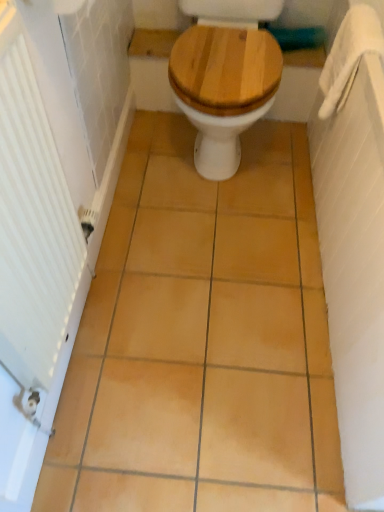
Where is `white fabric towel bar at upper right`? This screenshot has width=384, height=512. white fabric towel bar at upper right is located at coordinates (349, 55).

The image size is (384, 512). What do you see at coordinates (33, 229) in the screenshot? I see `white textured radiator at left` at bounding box center [33, 229].

What do you see at coordinates (354, 240) in the screenshot?
I see `white textured towel at right` at bounding box center [354, 240].

Measure the distance between point [177,60] and camera.

A distance of 1.39 meters exists between point [177,60] and camera.

Describe the element at coordinates (201, 340) in the screenshot. I see `matte yellow tile at center` at that location.

I want to click on white fabric towel bar at upper right, so click(x=349, y=55).

Is white fabric towel bar at upper right turned away from white textured towel at right?

That's right, white fabric towel bar at upper right is facing away from white textured towel at right.

Based on their positions, is white fabric towel bar at upper right located to the left or right of white textured towel at right?

From the image, it's evident that white fabric towel bar at upper right is to the left of white textured towel at right.

Which object is wider, white fabric towel bar at upper right or white textured towel at right?

white textured towel at right is wider.

Is white fabric towel bar at upper right positioned beyond the bounds of white textured towel at right?

No, white fabric towel bar at upper right is not outside of white textured towel at right.

Considering the points (19, 340) and (345, 89), which point is behind, point (19, 340) or point (345, 89)?

The point (345, 89) is more distant.

From the picture: Can you confirm if white textured radiator at left is positioned to the left of white fabric towel bar at upper right?

Yes, white textured radiator at left is to the left of white fabric towel bar at upper right.

At what (x,y) coordinates should I click in order to perform the action: click on towel bar on the right side of white textured radiator at left. Please return your answer as a coordinate pair (x, y). This screenshot has height=512, width=384. Looking at the image, I should click on (349, 55).

Can you confirm if white textured radiator at left is shorter than white fabric towel bar at upper right?

No.

Is wooden at center oriented towards white textured towel at right?

No, wooden at center is not turned towards white textured towel at right.

Which object is further away from the camera, wooden at center or white textured towel at right?

Positioned behind is wooden at center.

Which object is thinner, wooden at center or white textured towel at right?

Thinner between the two is white textured towel at right.

From a real-world perspective, is wooden at center below white textured towel at right?

No, from a real-world perspective, wooden at center is not beneath white textured towel at right.

Is point (331, 55) farther from viewer compared to point (315, 384)?

Yes, it is behind point (315, 384).

Considering the sizes of objects white fabric towel bar at upper right and matte yellow tile at center in the image provided, who is shorter, white fabric towel bar at upper right or matte yellow tile at center?

With less height is matte yellow tile at center.

Measure the distance from white fabric towel bar at upper right to matte yellow tile at center.

white fabric towel bar at upper right is 72.57 centimeters away from matte yellow tile at center.

From the image's perspective, which object appears higher, white fabric towel bar at upper right or matte yellow tile at center?

From the image's view, white fabric towel bar at upper right is above.

From the image's perspective, is white textured towel at right above or below white fabric towel bar at upper right?

white textured towel at right is below white fabric towel bar at upper right.

Between point (354, 45) and point (344, 44), which one is positioned in front?

The point (354, 45) is closer to the camera.

Based on the photo, which of these two, white textured towel at right or white fabric towel bar at upper right, is bigger?

white textured towel at right.

Considering the positions of objects white textured towel at right and white fabric towel bar at upper right in the image provided, who is more to the left, white textured towel at right or white fabric towel bar at upper right?

white fabric towel bar at upper right is more to the left.

Would you say wooden at center is outside white textured radiator at left?

Yes, wooden at center is outside of white textured radiator at left.

Image resolution: width=384 pixels, height=512 pixels. Identify the location of radiator on the left of the wooden at center. (33, 229).

Considering the sizes of objects wooden at center and white textured radiator at left in the image provided, who is shorter, wooden at center or white textured radiator at left?

wooden at center.

Is wooden at center facing away from white textured radiator at left?

wooden at center does not have its back to white textured radiator at left.

Considering the relative sizes of white textured towel at right and wooden at center in the image provided, is white textured towel at right shorter than wooden at center?

Indeed, white textured towel at right has a lesser height compared to wooden at center.

Would you consider white textured towel at right to be distant from wooden at center?

white textured towel at right is near wooden at center, not far away.

The height and width of the screenshot is (512, 384). What are the coordinates of `bath below the wooden at center (from a real-world perspective)` in the screenshot? It's located at (354, 240).

The image size is (384, 512). I want to click on towel bar above the white textured towel at right (from a real-world perspective), so click(349, 55).

Find the location of a particular element. radiator on the left of the white fabric towel bar at upper right is located at coordinates (33, 229).

From the image, which object appears to be nearer to white fabric towel bar at upper right, white textured towel at right or wooden at center?

white textured towel at right.

Which object lies further to the anchor point white textured towel at right, matte yellow tile at center or white textured radiator at left?

Based on the image, white textured radiator at left appears to be further to white textured towel at right.

Considering their positions, is white textured radiator at left positioned closer to matte yellow tile at center than white fabric towel bar at upper right?

The object closer to matte yellow tile at center is white textured radiator at left.

Based on their spatial positions, is wooden at center or white textured radiator at left further from matte yellow tile at center?

wooden at center lies further to matte yellow tile at center than the other object.

Based on the photo, from the image, which object appears to be nearer to matte yellow tile at center, white fabric towel bar at upper right or white textured towel at right?

white textured towel at right.

Based on their spatial positions, is white textured towel at right or white textured radiator at left closer to white fabric towel bar at upper right?

Among the two, white textured towel at right is located nearer to white fabric towel bar at upper right.

Estimate the real-world distances between objects in this image. Which object is further from white textured towel at right, matte yellow tile at center or white fabric towel bar at upper right?

matte yellow tile at center is positioned further to the anchor white textured towel at right.

Considering their positions, is white textured radiator at left positioned further to white fabric towel bar at upper right than white textured towel at right?

white textured radiator at left is further to white fabric towel bar at upper right.

Where is `ceramic tile situated between white textured radiator at left and white fabric towel bar at upper right from left to right`? The image size is (384, 512). ceramic tile situated between white textured radiator at left and white fabric towel bar at upper right from left to right is located at coordinates (201, 340).

At what (x,y) coordinates should I click in order to perform the action: click on bath that lies between white fabric towel bar at upper right and matte yellow tile at center from top to bottom. Please return your answer as a coordinate pair (x, y). Looking at the image, I should click on (354, 240).

Identify the location of radiator between wooden at center and matte yellow tile at center from top to bottom. The image size is (384, 512). pos(33,229).

Identify the location of towel bar between white textured radiator at left and white textured towel at right from left to right. (349, 55).